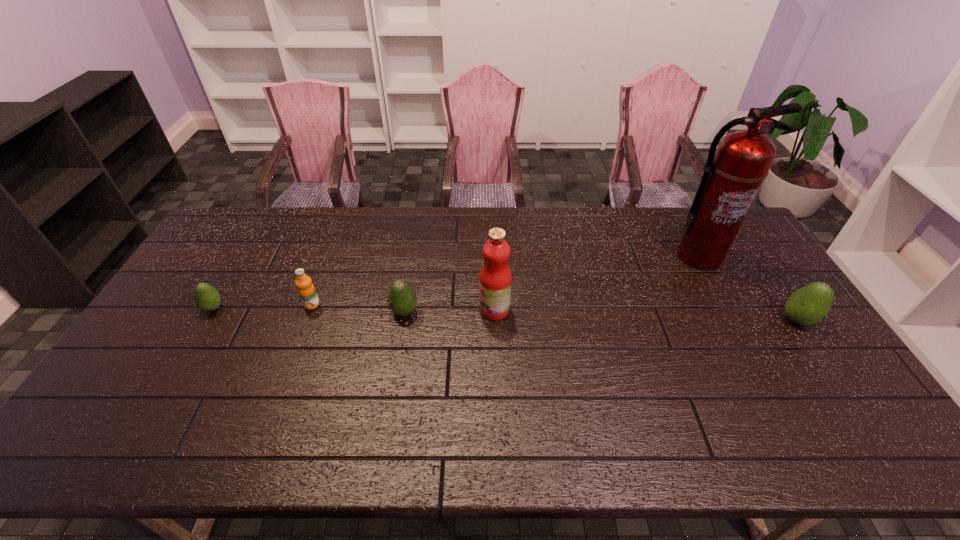
This screenshot has height=540, width=960. Identify the location of the second object from left to right. (306, 290).

The image size is (960, 540). I want to click on vacant point located 0.190m on the front of the leftmost avocado, so click(x=177, y=370).

You are a GUI agent. You are given a task and a screenshot of the screen. Output one action in this format:
    pyautogui.click(x=<x>, y=<y>)
    Task: Click on the blank space located 0.270m on the back of the second avocado from left to right
    The image size is (960, 540).
    Given the screenshot: What is the action you would take?
    pyautogui.click(x=416, y=245)

In order to click on free spot located 0.340m on the back of the rightmost object in this screenshot , I will do `click(741, 237)`.

I want to click on blank space located on the side of the tallest object with the handle and hose, so click(x=715, y=287).

Locate an element on the screen. free spot located on the front label of the second tallest object is located at coordinates (406, 309).

Where is `vacant space positioned on the front label of the second tallest object`? Image resolution: width=960 pixels, height=540 pixels. vacant space positioned on the front label of the second tallest object is located at coordinates click(x=406, y=309).

The height and width of the screenshot is (540, 960). What are the coordinates of `blank space located 0.270m on the front label of the second tallest object` in the screenshot? It's located at (389, 309).

Find the location of a particular element. free space located on the label of the second object from left to right is located at coordinates (285, 376).

Where is `object located in the far edge section of the desktop`? object located in the far edge section of the desktop is located at coordinates (733, 174).